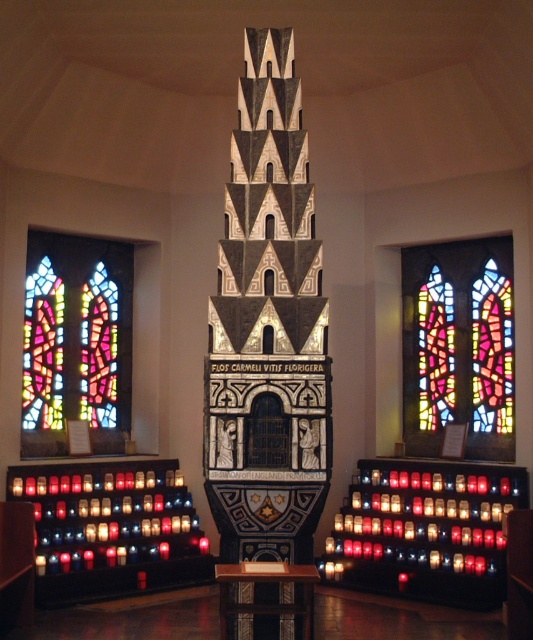
Question: Among these objects, which one is nearest to the camera?

Choices:
 (A) stained glass window at left
 (B) stained glass window at center

Answer: (B)

Question: Is the position of stained glass window at center less distant than that of stained glass window at left?

Choices:
 (A) no
 (B) yes

Answer: (B)

Question: Is stained glass window at center positioned behind stained glass window at left?

Choices:
 (A) no
 (B) yes

Answer: (A)

Question: Which object appears farthest from the camera in this image?

Choices:
 (A) stained glass window at left
 (B) black stone tower at center
 (C) stained glass window at center

Answer: (A)

Question: Which of the following is the closest to the observer?

Choices:
 (A) (454, 250)
 (B) (208, 396)
 (C) (66, 346)

Answer: (B)

Question: Considering the relative positions of black stone tower at center and stained glass window at left in the image provided, where is black stone tower at center located with respect to stained glass window at left?

Choices:
 (A) left
 (B) right

Answer: (B)